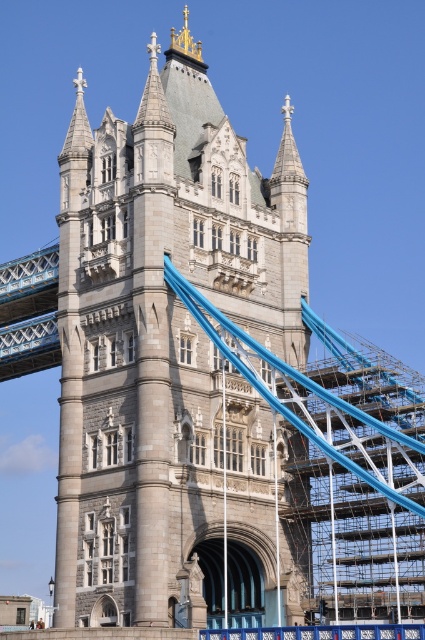
You are standing at the base of the gray stone tower at center. If you look directly upward, which direction would the blue ropes or cables extending diagonally across the frame be relative to the tower?

The blue ropes or cables extending diagonally across the frame are located above the gray stone tower at center since they are part of the bridge suspension system and the tower supports them.

You are a tourist standing on the walkway of Tower Bridge and notice a point marked at coordinates (170, 355). Based on the scene description, what significant structure does this point indicate?

The point marked at coordinates (170, 355) indicates the location of the gray stone tower at center, which is a central part of Tower Bridge.

You are a maintenance worker standing on the gray stone tower at center and need to reach the blue metallic bridge at left. The safety regulations state that you must stay within 30 feet of the bridge to perform repairs. Can you safely perform the repairs from your current position?

The gray stone tower at center is 35.12 feet away from the blue metallic bridge at left. Since the safety regulations require staying within 30 feet, you are 5.12 feet beyond the allowed distance and cannot safely perform the repairs from your current position.